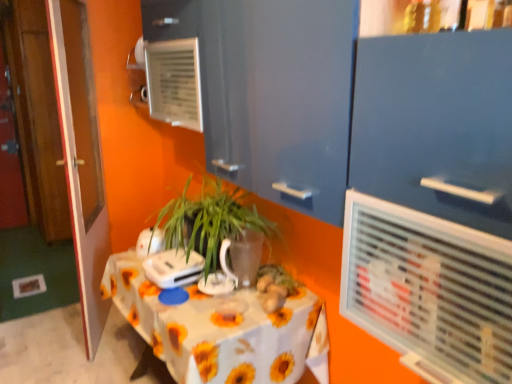
Where is `free space above white plastic appliance at center, arranged as the 1th appliance when viewed from the front (from a real-world perspective)`? The height and width of the screenshot is (384, 512). free space above white plastic appliance at center, arranged as the 1th appliance when viewed from the front (from a real-world perspective) is located at coordinates (179, 257).